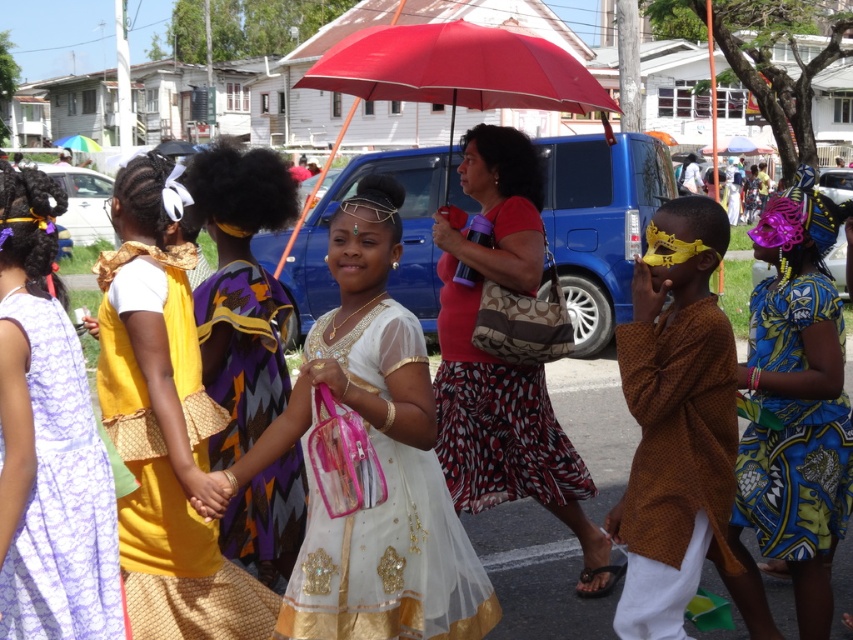
Question: Does white sheer dress at center have a smaller size compared to red matte umbrella at center?

Choices:
 (A) yes
 (B) no

Answer: (A)

Question: Based on their relative distances, which object is farther from the rainbow fabric umbrella at upper left?

Choices:
 (A) matte yellow mask at center
 (B) red fabric umbrella at center
 (C) red matte umbrella at center

Answer: (A)

Question: Based on their relative distances, which object is nearer to the white sheer dress at center?

Choices:
 (A) lace fabric dress at left
 (B) matte yellow mask at center

Answer: (A)

Question: In this image, where is blue printed fabric dress at right located relative to rainbow fabric umbrella at upper left?

Choices:
 (A) below
 (B) above

Answer: (A)

Question: Does white sheer dress at center come in front of rainbow fabric umbrella at upper left?

Choices:
 (A) yes
 (B) no

Answer: (A)

Question: Which of the following is the farthest from the observer?

Choices:
 (A) (86, 138)
 (B) (761, 518)
 (C) (107, 528)

Answer: (A)